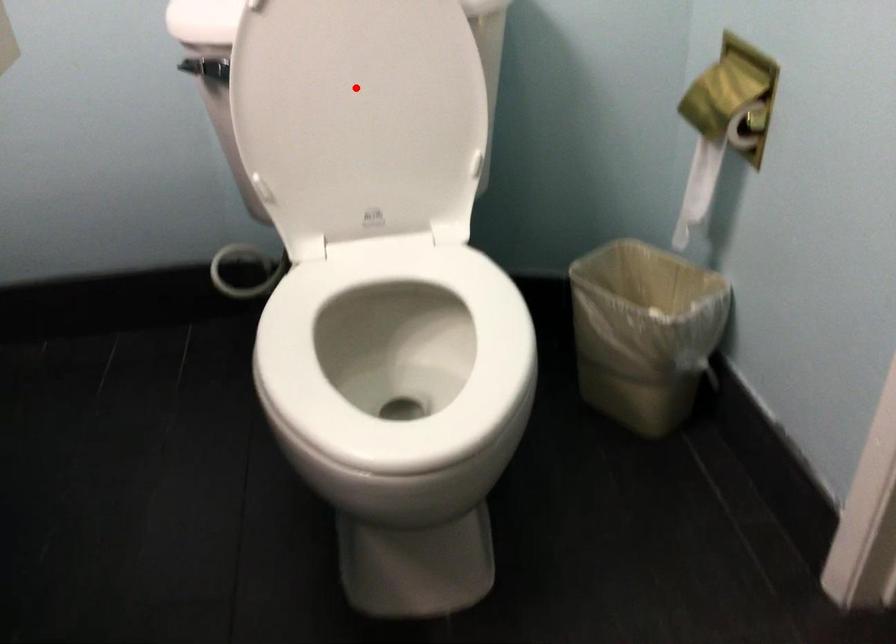
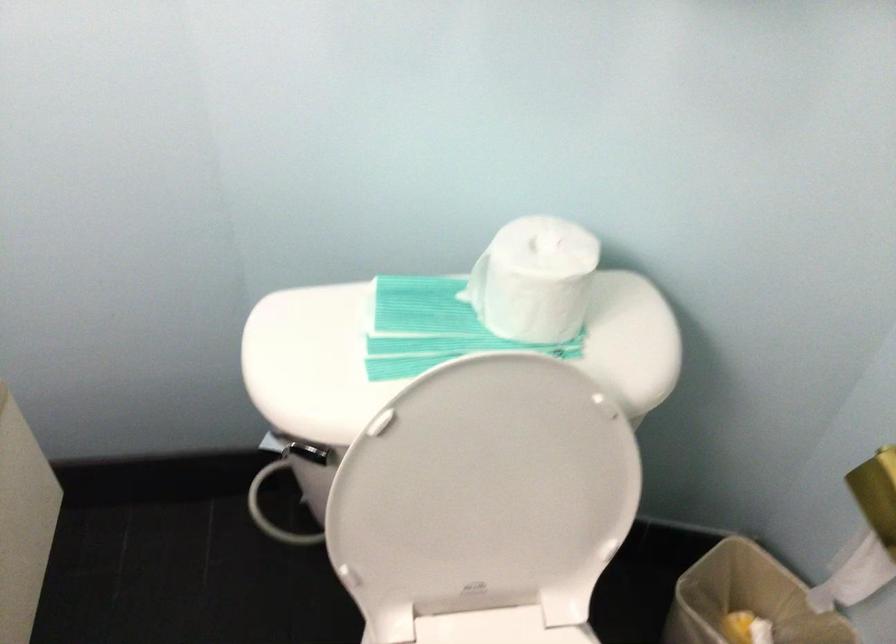
Question: I am providing you with two images of the same scene from different viewpoints. Image1 has a red point marked. In image2, the corresponding 3D location appears at what relative position? Reply with the corresponding letter.

Choices:
 (A) Closer
 (B) Farther

Answer: (A)